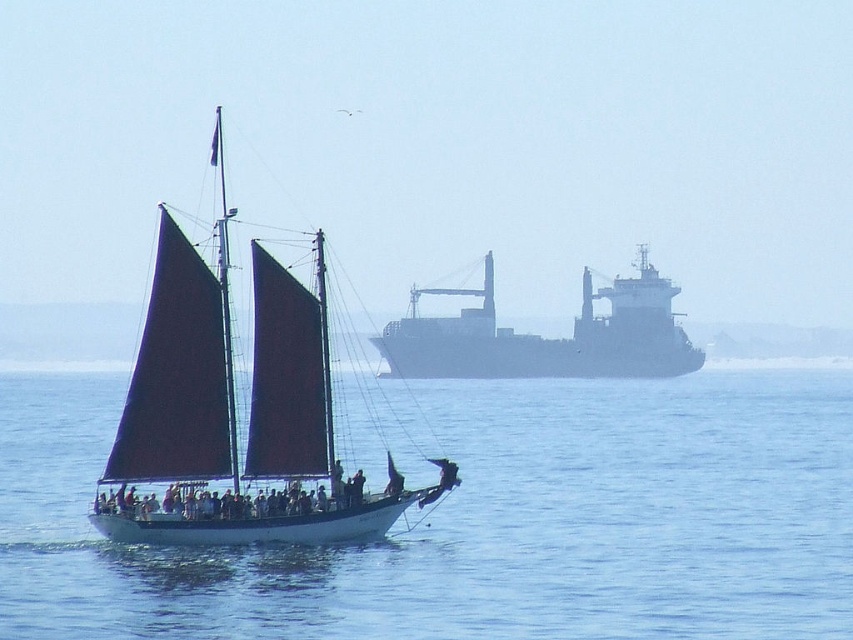
You are an observer on the shore looking at the image. You notice the white smooth water at center and the matte red sails at center. Which object takes up more area in the image?

The matte red sails at center occupy more space than the white smooth water at center, so the matte red sails at center takes up more area in the image.